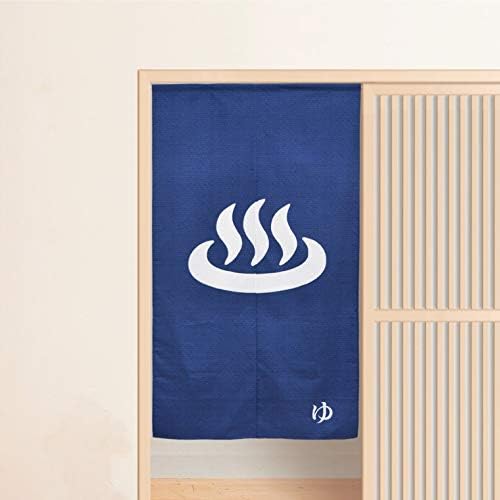
Where is `side wall`? side wall is located at coordinates (82, 357).